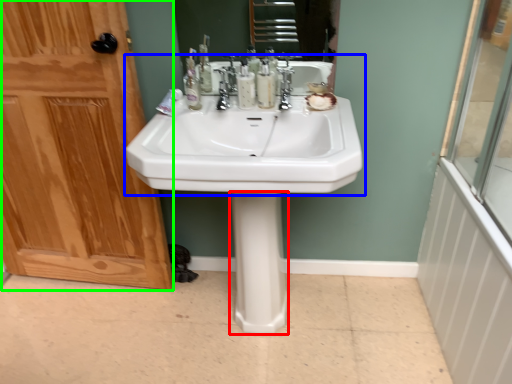
Question: Considering the real-world distances, which object is closest to bidet (highlighted by a red box)? sink (highlighted by a blue box) or door (highlighted by a green box).

Choices:
 (A) sink
 (B) door

Answer: (A)